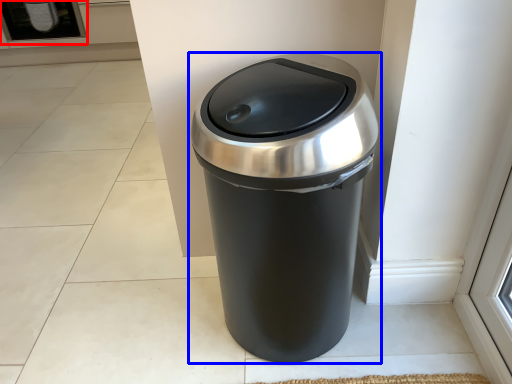
Question: Which point is closer to the camera, screen door (highlighted by a red box) or waste container (highlighted by a blue box)?

Choices:
 (A) screen door
 (B) waste container

Answer: (B)